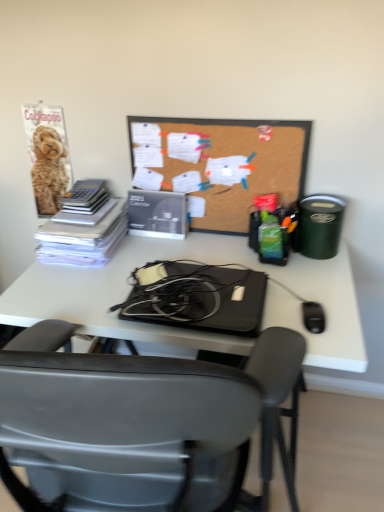
Where is `blank space situated above black plastic chair at center (from a real-world perspective)`? The height and width of the screenshot is (512, 384). blank space situated above black plastic chair at center (from a real-world perspective) is located at coordinates (186, 257).